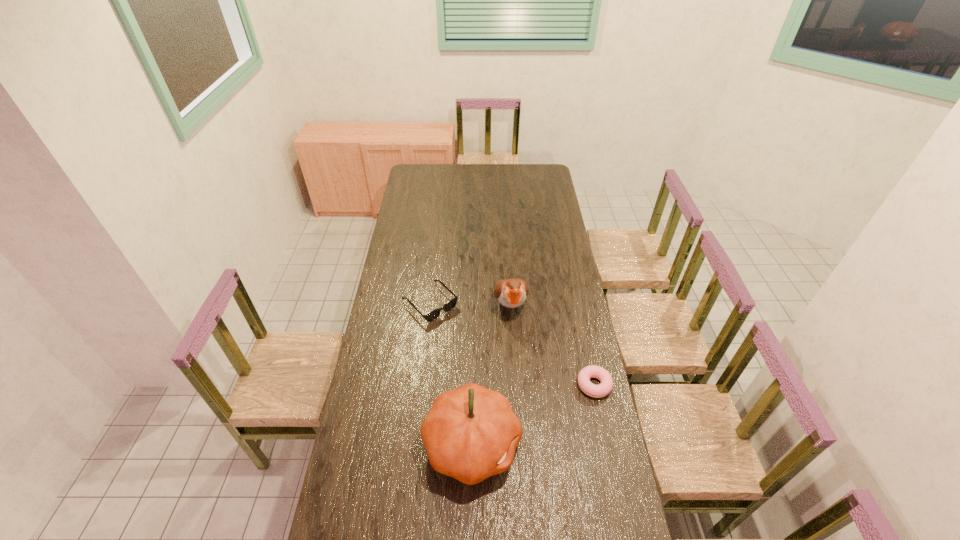
At what (x,y) coordinates should I click in order to perform the action: click on unoccupied position between the pumpkin and the sunglasses. Please return your answer as a coordinate pair (x, y). Looking at the image, I should click on (451, 374).

Where is `vacant region between the bird and the pumpkin`? vacant region between the bird and the pumpkin is located at coordinates (491, 375).

You are a GUI agent. You are given a task and a screenshot of the screen. Output one action in this format:
    pyautogui.click(x=<x>, y=<y>)
    Task: Click on the vacant area that lies between the doughnut and the sunglasses
    Image resolution: width=960 pixels, height=540 pixels.
    Given the screenshot: What is the action you would take?
    pyautogui.click(x=512, y=344)

Find the location of `vacant area between the rightmost object and the third tallest object`. vacant area between the rightmost object and the third tallest object is located at coordinates (512, 344).

The width and height of the screenshot is (960, 540). Find the location of `vacant area that lies between the bird and the nearest object`. vacant area that lies between the bird and the nearest object is located at coordinates (491, 375).

Where is `free space between the rightmost object and the pumpkin`? free space between the rightmost object and the pumpkin is located at coordinates (533, 414).

Locate an element on the screen. free space between the pumpkin and the sunglasses is located at coordinates (451, 374).

Find the location of a particular element. The image size is (960, 540). vacant region between the doughnut and the bird is located at coordinates (552, 346).

I want to click on empty location between the bird and the shortest object, so click(552, 346).

Locate an element on the screen. free space between the pumpkin and the sunglasses is located at coordinates (451, 374).